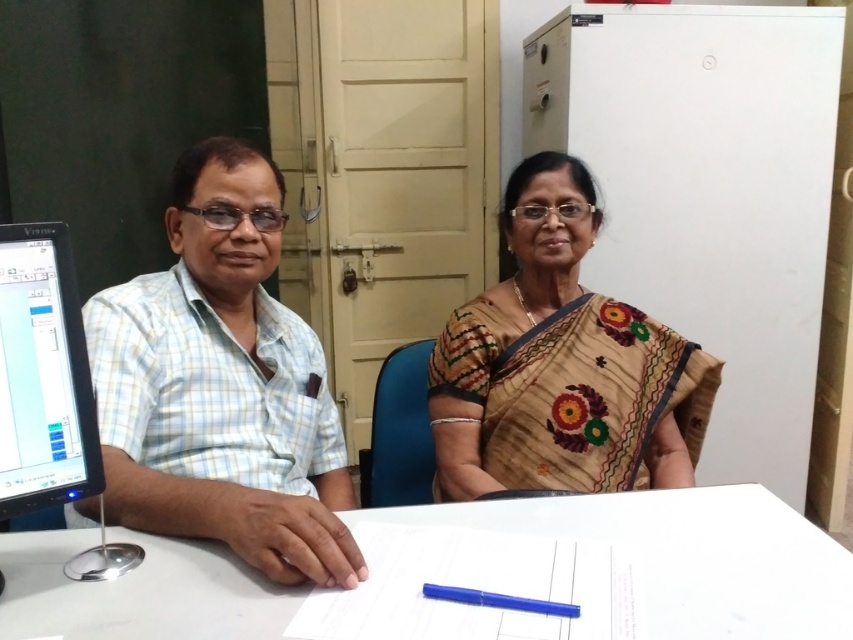
Question: Which of the following is the farthest from the observer?

Choices:
 (A) light brown fabric saree at center
 (B) blue plastic pen at center

Answer: (A)

Question: Observing the image, what is the correct spatial positioning of beige embroidered saree at center in reference to black glossy monitor at left?

Choices:
 (A) left
 (B) right

Answer: (B)

Question: Which of the following is the farthest from the observer?

Choices:
 (A) (57, 624)
 (B) (498, 330)
 (C) (193, 394)

Answer: (B)

Question: Among these points, which one is farthest from the camera?

Choices:
 (A) coord(479,589)
 (B) coord(814,538)

Answer: (B)

Question: Does light brown fabric saree at center have a larger size compared to black glossy monitor at left?

Choices:
 (A) no
 (B) yes

Answer: (B)

Question: Observing the image, what is the correct spatial positioning of light brown fabric saree at center in reference to blue plastic pen at center?

Choices:
 (A) left
 (B) right

Answer: (A)